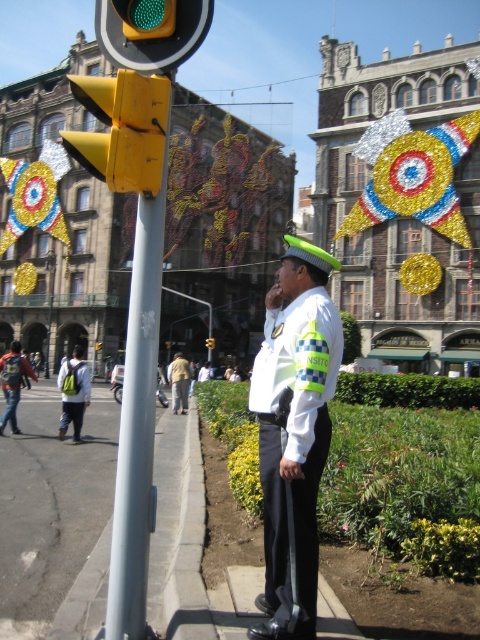
You are a pedestrian trying to reach the traffic officer standing to the right of the traffic light. You are currently holding the light gray backpack at left and the light brown fabric jacket at center. Which item do you need to move first to proceed towards the officer?

The light gray backpack at left is positioned over light brown fabric jacket at center, so you need to move the light gray backpack at left first to proceed towards the officer.

You are a pedestrian trying to decide which item to carry with you. You see the light gray backpack at left and the light brown fabric jacket at center. Which item has a larger size?

The light gray backpack at left is bigger than the light brown fabric jacket at center.

You are a delivery person who needs to place a package on the ground near the yellow matte traffic light at left and the light gray backpack at left. Which object is shorter so that the package won not block the traffic light?

The yellow matte traffic light at left is shorter than the light gray backpack at left, so placing the package near the yellow matte traffic light at left would prevent it from blocking the traffic light.